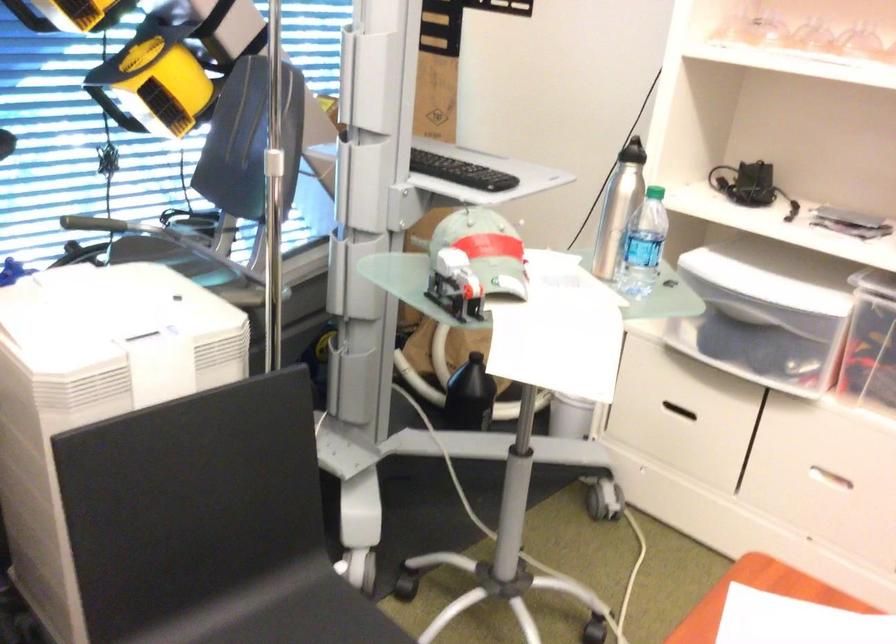
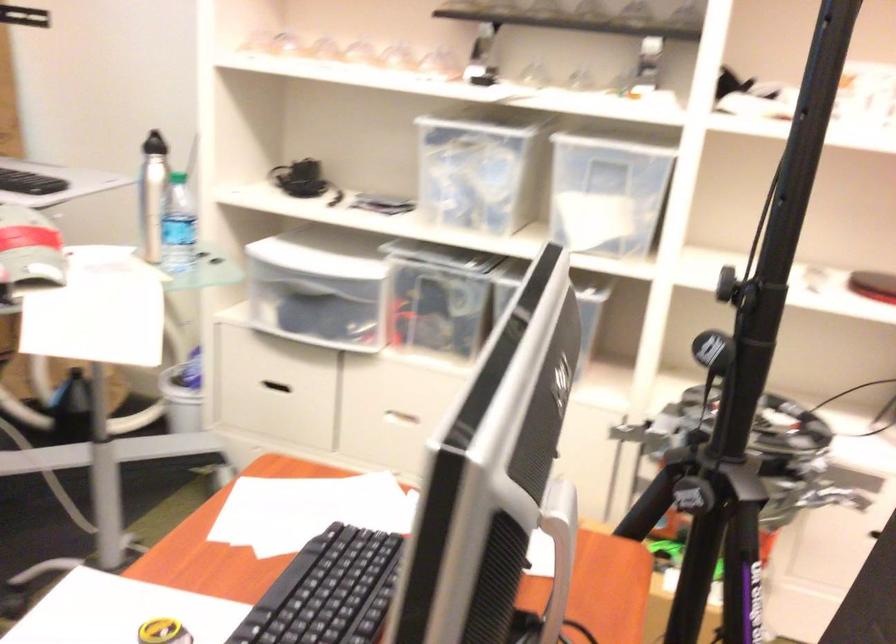
Find the pixel in the second image that matches (679,409) in the first image.

(271, 389)